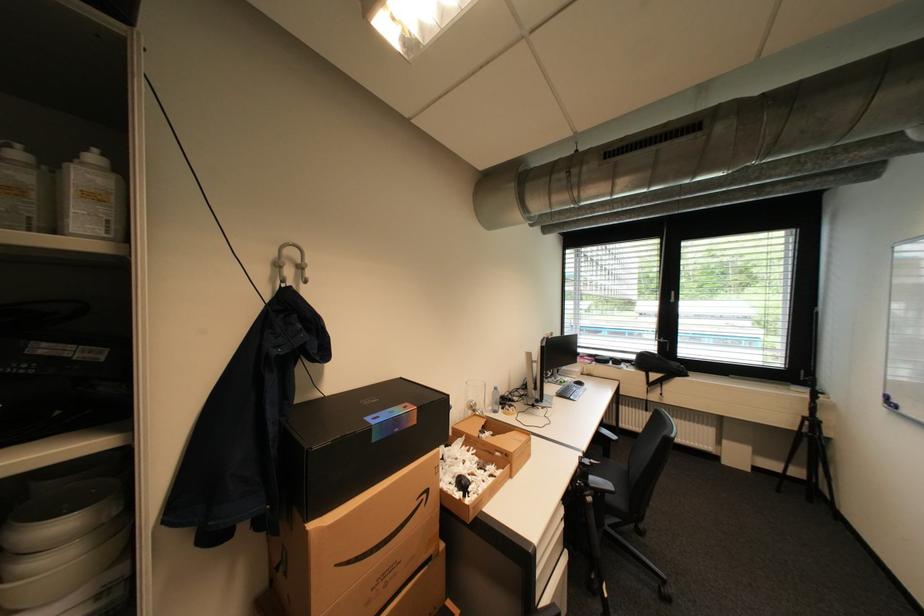
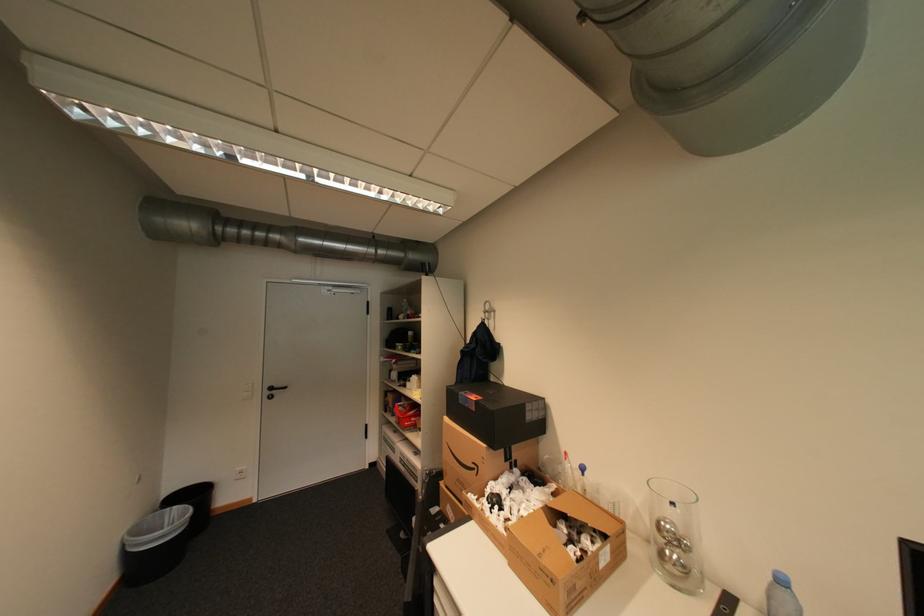
The point at [504,389] is marked in the first image. Where is the corresponding point in the second image?

(791, 582)